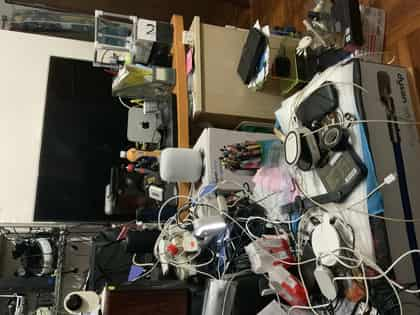
Identify the location of cabinet. This screenshot has height=315, width=420. (231, 92).